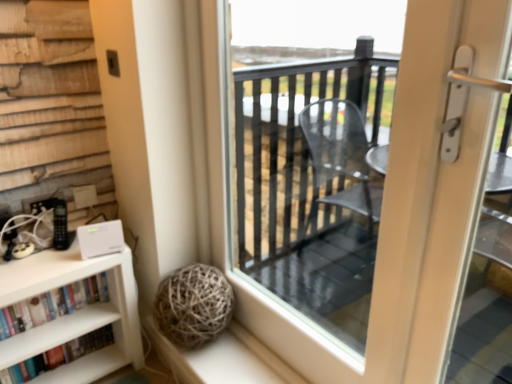
Question: Does white matte bookshelf at lower left, positioned as the second book in bottom-to-top order, turn towards hardcover books at lower left, placed as the second book when sorted from top to bottom?

Choices:
 (A) no
 (B) yes

Answer: (A)

Question: Can you confirm if white matte bookshelf at lower left, positioned as the second book in bottom-to-top order, is thinner than hardcover books at lower left, placed as the second book when sorted from top to bottom?

Choices:
 (A) no
 (B) yes

Answer: (A)

Question: Can we say white matte bookshelf at lower left, positioned as the 1th book in top-to-bottom order, lies outside hardcover books at lower left, placed as the second book when sorted from top to bottom?

Choices:
 (A) no
 (B) yes

Answer: (B)

Question: Is white matte bookshelf at lower left, positioned as the second book in bottom-to-top order, positioned far away from hardcover books at lower left, which ranks as the first book in bottom-to-top order?

Choices:
 (A) no
 (B) yes

Answer: (A)

Question: Is white matte bookshelf at lower left, positioned as the second book in bottom-to-top order, facing away from hardcover books at lower left, which ranks as the first book in bottom-to-top order?

Choices:
 (A) yes
 (B) no

Answer: (B)

Question: From the image's perspective, would you say white matte bookshelf at lower left, positioned as the 1th book in top-to-bottom order, is positioned over hardcover books at lower left, placed as the second book when sorted from top to bottom?

Choices:
 (A) no
 (B) yes

Answer: (B)

Question: Is white matte bookshelf at lower left, positioned as the second book in bottom-to-top order, smaller than transparent glass door at center?

Choices:
 (A) no
 (B) yes

Answer: (B)

Question: Does white matte bookshelf at lower left, positioned as the 1th book in top-to-bottom order, turn towards transparent glass door at center?

Choices:
 (A) yes
 (B) no

Answer: (B)

Question: Is white matte bookshelf at lower left, positioned as the 1th book in top-to-bottom order, at the left side of transparent glass door at center?

Choices:
 (A) no
 (B) yes

Answer: (B)

Question: From a real-world perspective, is white matte bookshelf at lower left, positioned as the 1th book in top-to-bottom order, located beneath transparent glass door at center?

Choices:
 (A) yes
 (B) no

Answer: (A)

Question: Is white matte bookshelf at lower left, positioned as the 1th book in top-to-bottom order, outside of transparent glass door at center?

Choices:
 (A) yes
 (B) no

Answer: (A)

Question: Considering the relative positions of white matte bookshelf at lower left, positioned as the 1th book in top-to-bottom order, and transparent glass door at center in the image provided, is white matte bookshelf at lower left, positioned as the 1th book in top-to-bottom order, to the right of transparent glass door at center from the viewer's perspective?

Choices:
 (A) no
 (B) yes

Answer: (A)

Question: Is transparent glass door at center touching white matte bookshelf at lower left, positioned as the second book in bottom-to-top order?

Choices:
 (A) yes
 (B) no

Answer: (B)